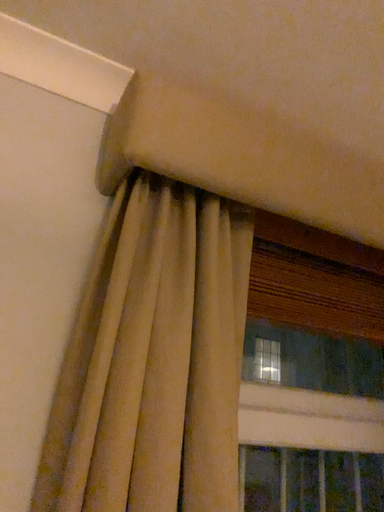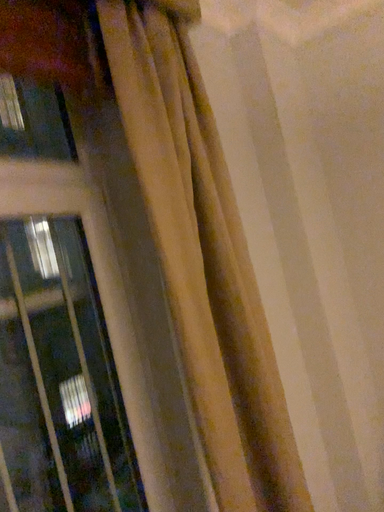
Question: Which way did the camera rotate in the video?

Choices:
 (A) rotated right
 (B) rotated left

Answer: (A)